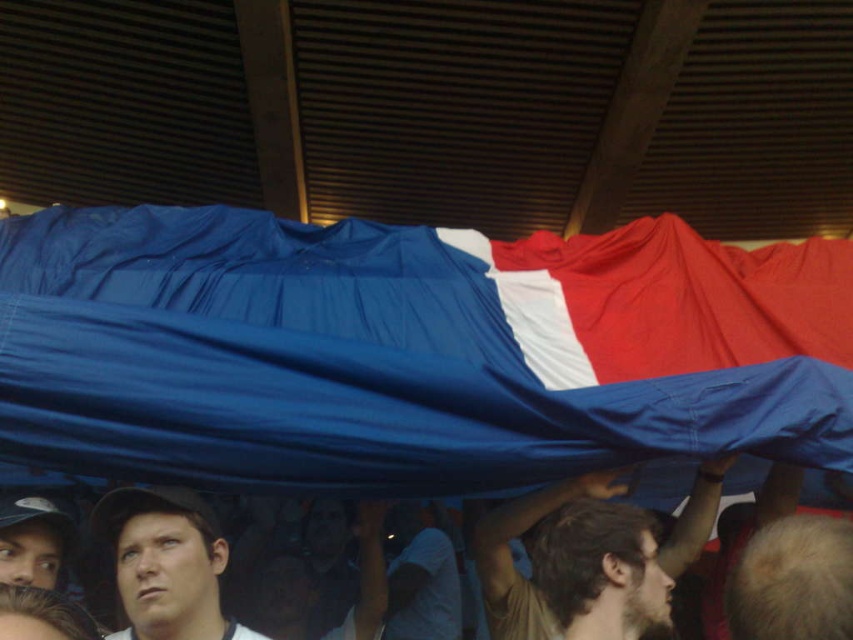
You are a photographer at the event and want to capture both the brown textured shirt at center and the matte black cap at lower left in a single photo. Since you can only focus on one object, which one should you choose to ensure it appears larger in the final image?

The brown textured shirt at center is bigger than the matte black cap at lower left, so you should focus on the brown textured shirt at center to ensure it appears larger in the photo.

You are a photographer trying to capture a clear shot of the brown textured shirt at center and the blue fabric at center. Which object will appear larger in your photo?

The brown textured shirt at center will appear larger in the photo since it has a greater height compared to the blue fabric at center.